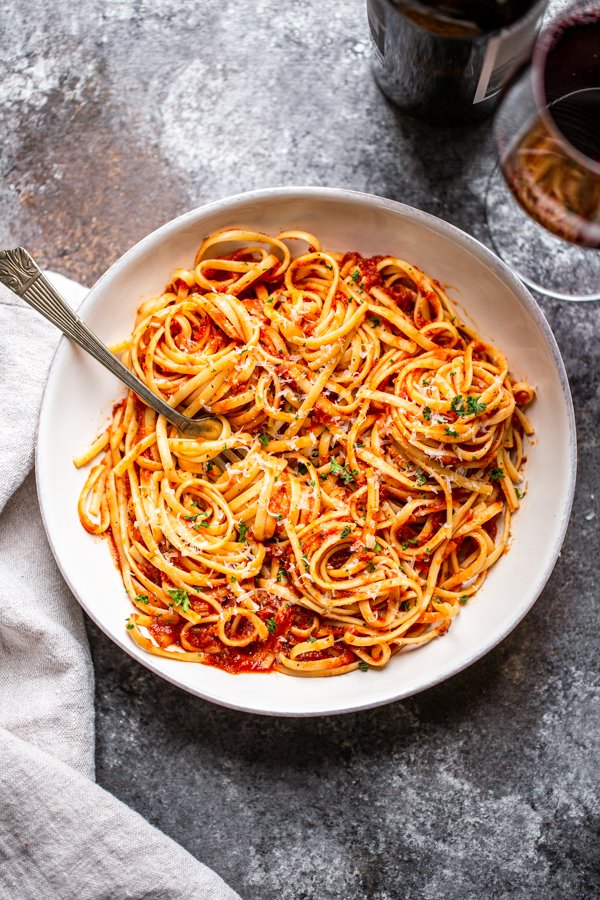
Find the location of a particular element. This screenshot has width=600, height=900. cloth napkin is located at coordinates (40, 671).